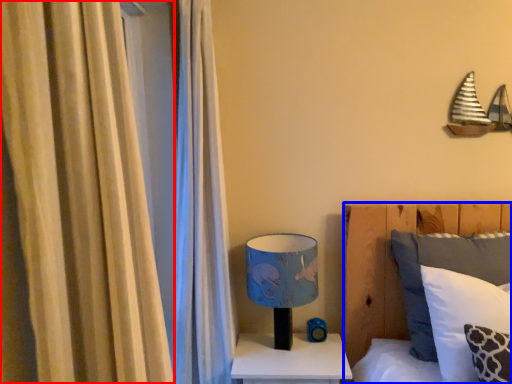
Question: Among these objects, which one is nearest to the camera, curtain (highlighted by a red box) or bed (highlighted by a blue box)?

Choices:
 (A) curtain
 (B) bed

Answer: (A)